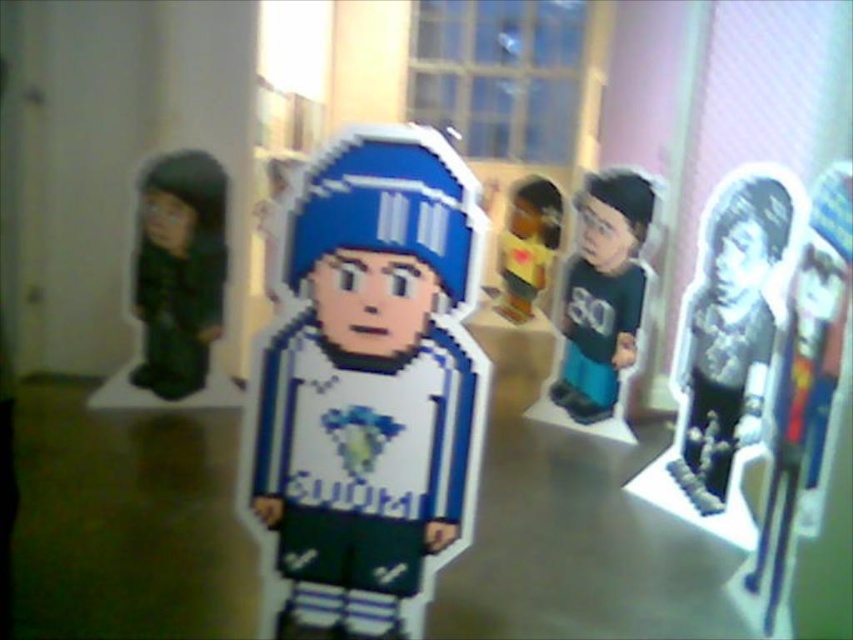
Which is more to the right, pixelated blue and white figure at center or matte yellow toy at center?

Positioned to the right is matte yellow toy at center.

The width and height of the screenshot is (853, 640). What do you see at coordinates (367, 385) in the screenshot?
I see `pixelated blue and white figure at center` at bounding box center [367, 385].

At what (x,y) coordinates should I click in order to perform the action: click on pixelated blue and white figure at center. Please return your answer as a coordinate pair (x, y). The height and width of the screenshot is (640, 853). Looking at the image, I should click on (367, 385).

Is white glossy paper cutout at center to the left of matte green jersey at center from the viewer's perspective?

In fact, white glossy paper cutout at center is to the right of matte green jersey at center.

Is point (758, 250) in front of point (624, 227)?

Yes.

Where is `white glossy paper cutout at center`? This screenshot has width=853, height=640. white glossy paper cutout at center is located at coordinates (729, 330).

Is pixelated blue and white figure at center closer to camera compared to white glossy paper cutout at center?

That is True.

Who is more forward, (381, 268) or (726, 317)?

Positioned in front is point (381, 268).

Which is in front, point (430, 438) or point (695, 468)?

Point (430, 438) is more forward.

What are the coordinates of `pixelated blue and white figure at center` in the screenshot? It's located at (367, 385).